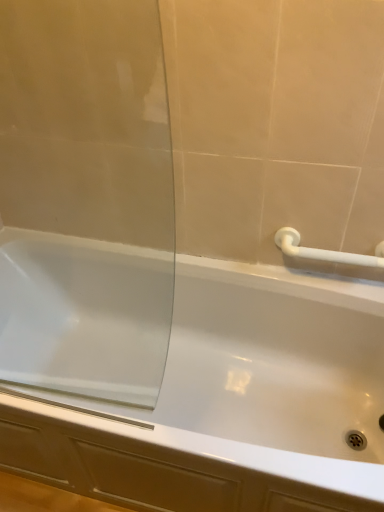
Question: Would you say white glossy bathtub at center is part of transparent glass screen door at left's contents?

Choices:
 (A) yes
 (B) no

Answer: (B)

Question: Is transparent glass screen door at left in contact with white glossy bathtub at center?

Choices:
 (A) no
 (B) yes

Answer: (A)

Question: Is transparent glass screen door at left further to camera compared to white glossy bathtub at center?

Choices:
 (A) no
 (B) yes

Answer: (A)

Question: Does transparent glass screen door at left have a larger size compared to white glossy bathtub at center?

Choices:
 (A) no
 (B) yes

Answer: (A)

Question: Considering the relative sizes of transparent glass screen door at left and white glossy bathtub at center in the image provided, is transparent glass screen door at left smaller than white glossy bathtub at center?

Choices:
 (A) no
 (B) yes

Answer: (B)

Question: Looking at their shapes, would you say white plastic towel bar at upper right is wider or thinner than transparent glass screen door at left?

Choices:
 (A) thin
 (B) wide

Answer: (B)

Question: Considering the positions of point (339, 257) and point (120, 282), is point (339, 257) closer or farther from the camera than point (120, 282)?

Choices:
 (A) farther
 (B) closer

Answer: (B)

Question: In the image, is white plastic towel bar at upper right on the left side or the right side of transparent glass screen door at left?

Choices:
 (A) left
 (B) right

Answer: (B)

Question: Is white plastic towel bar at upper right inside the boundaries of transparent glass screen door at left, or outside?

Choices:
 (A) outside
 (B) inside

Answer: (A)

Question: In the image, is white plastic towel bar at upper right positioned in front of or behind white glossy bathtub at center?

Choices:
 (A) front
 (B) behind

Answer: (B)

Question: From the image's perspective, is white plastic towel bar at upper right above or below white glossy bathtub at center?

Choices:
 (A) below
 (B) above

Answer: (B)

Question: Is point (372, 256) closer or farther from the camera than point (36, 232)?

Choices:
 (A) closer
 (B) farther

Answer: (A)

Question: Is white plastic towel bar at upper right bigger or smaller than white glossy bathtub at center?

Choices:
 (A) big
 (B) small

Answer: (B)

Question: Considering their positions, is transparent glass screen door at left located in front of or behind white plastic towel bar at upper right?

Choices:
 (A) behind
 (B) front

Answer: (B)

Question: Considering the positions of transparent glass screen door at left and white plastic towel bar at upper right in the image, is transparent glass screen door at left taller or shorter than white plastic towel bar at upper right?

Choices:
 (A) short
 (B) tall

Answer: (B)